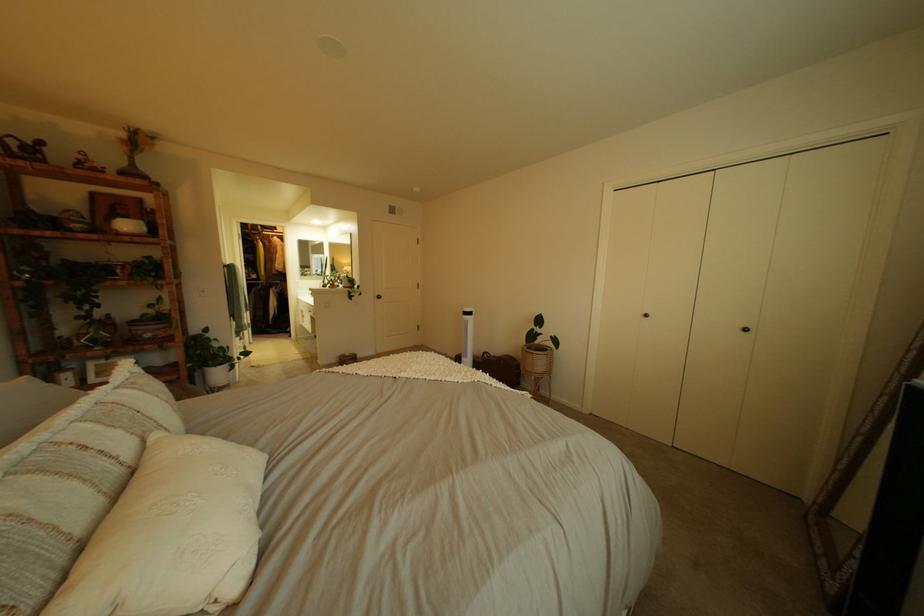
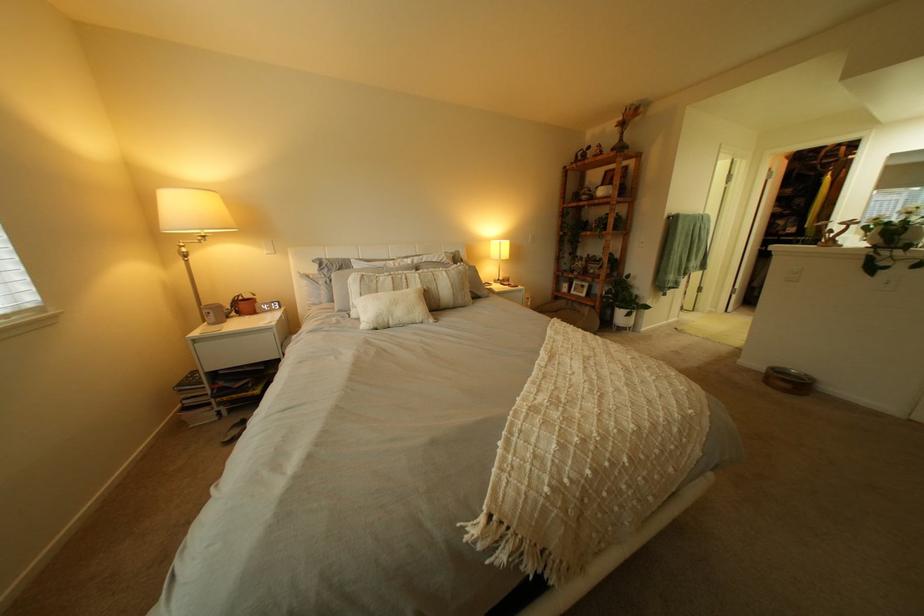
Find the pixel in the second image that matches point 225,363 in the first image.

(633, 305)